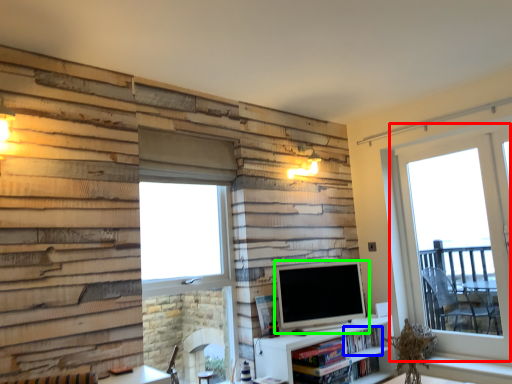
Question: Based on their relative distances, which object is nearer to window (highlighted by a red box)? Choose from book (highlighted by a blue box) and television (highlighted by a green box).

Choices:
 (A) book
 (B) television

Answer: (B)